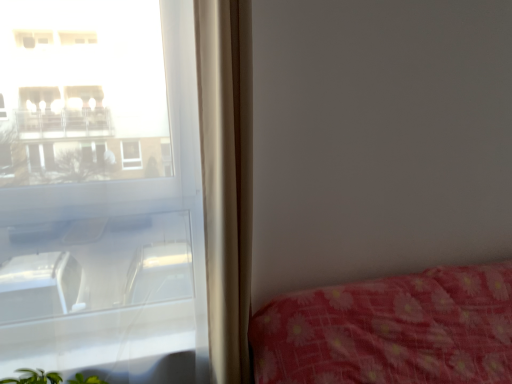
Locate an element on the screen. This screenshot has height=384, width=512. transparent glass window at left is located at coordinates (101, 191).

Describe the element at coordinates (101, 191) in the screenshot. I see `transparent glass window at left` at that location.

Find the location of a particular element. beige fabric curtain at left is located at coordinates (227, 178).

In order to face beige fabric curtain at left, should I rotate leftwards or rightwards?

You should rotate left by 3.410 degrees.

Describe the element at coordinates (227, 178) in the screenshot. The width and height of the screenshot is (512, 384). I see `beige fabric curtain at left` at that location.

Identify the location of transparent glass window at left. Image resolution: width=512 pixels, height=384 pixels. (101, 191).

Is beige fabric curtain at left to the right of transparent glass window at left from the viewer's perspective?

Indeed, beige fabric curtain at left is positioned on the right side of transparent glass window at left.

Is the position of beige fabric curtain at left more distant than that of transparent glass window at left?

That is True.

Which point is more distant from viewer, (212, 282) or (78, 37)?

The point (212, 282) is behind.

From the image's perspective, relative to transparent glass window at left, is beige fabric curtain at left above or below?

beige fabric curtain at left is above transparent glass window at left.

From a real-world perspective, between beige fabric curtain at left and transparent glass window at left, who is vertically lower?

transparent glass window at left is physically lower.

Looking at this image, in terms of width, does beige fabric curtain at left look wider or thinner when compared to transparent glass window at left?

In the image, beige fabric curtain at left appears to be wider than transparent glass window at left.

Is beige fabric curtain at left taller or shorter than transparent glass window at left?

Clearly, beige fabric curtain at left is shorter compared to transparent glass window at left.

Does beige fabric curtain at left have a larger size compared to transparent glass window at left?

Actually, beige fabric curtain at left might be smaller than transparent glass window at left.

Is beige fabric curtain at left situated inside transparent glass window at left or outside?

beige fabric curtain at left is spatially situated outside transparent glass window at left.

Is beige fabric curtain at left placed right next to transparent glass window at left?

There is a gap between beige fabric curtain at left and transparent glass window at left.

Is beige fabric curtain at left turned away from transparent glass window at left?

That's not correct — beige fabric curtain at left is not looking away from transparent glass window at left.

Image resolution: width=512 pixels, height=384 pixels. Identify the location of window in front of the beige fabric curtain at left. (101, 191).

Does transparent glass window at left appear on the left side of beige fabric curtain at left?

Correct, you'll find transparent glass window at left to the left of beige fabric curtain at left.

Is transparent glass window at left in front of beige fabric curtain at left?

Yes, it is in front of beige fabric curtain at left.

Does point (31, 95) appear closer or farther from the camera than point (238, 190)?

Point (31, 95) appears to be closer to the viewer than point (238, 190).

From the image's perspective, is transparent glass window at left positioned above or below beige fabric curtain at left?

From the image's perspective, transparent glass window at left appears below beige fabric curtain at left.

From a real-world perspective, which object stands above the other?

In real-world perspective, beige fabric curtain at left is above.

Considering the relative sizes of transparent glass window at left and beige fabric curtain at left in the image provided, is transparent glass window at left wider than beige fabric curtain at left?

Incorrect, the width of transparent glass window at left does not surpass that of beige fabric curtain at left.

Between transparent glass window at left and beige fabric curtain at left, which one has less height?

beige fabric curtain at left is shorter.

In terms of size, does transparent glass window at left appear bigger or smaller than beige fabric curtain at left?

Clearly, transparent glass window at left is larger in size than beige fabric curtain at left.

In the scene shown: Can we say transparent glass window at left lies outside beige fabric curtain at left?

Yes, transparent glass window at left is outside of beige fabric curtain at left.

Are transparent glass window at left and beige fabric curtain at left making contact?

No, transparent glass window at left is not touching beige fabric curtain at left.

Is transparent glass window at left oriented away from beige fabric curtain at left?

No.

How different are the orientations of transparent glass window at left and beige fabric curtain at left in degrees?

1.5e-05 degrees.

I want to click on curtain above the transparent glass window at left (from the image's perspective), so click(x=227, y=178).

Locate an element on the screen. This screenshot has height=384, width=512. curtain behind the transparent glass window at left is located at coordinates (227, 178).

Locate an element on the screen. The image size is (512, 384). curtain located on the right of transparent glass window at left is located at coordinates (227, 178).